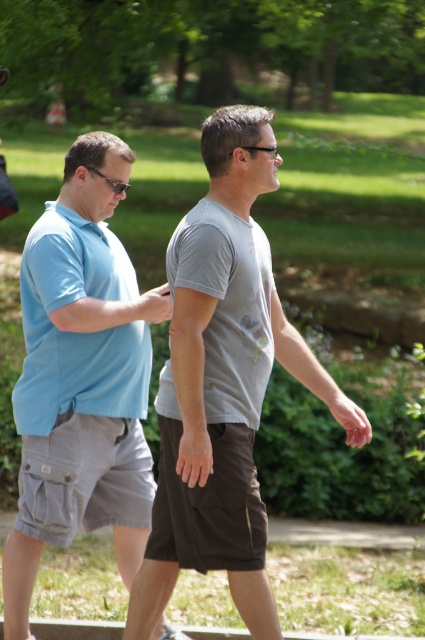
You are a photographer trying to capture a candid shot of the two people in the park. You want to ensure that both the matte blue polo shirt at left and the black plastic glasses at center are visible in the frame. Based on their positions, which object should you focus on first to include both in the shot?

Since the matte blue polo shirt at left is to the left of the black plastic glasses at center, you should focus on the matte blue polo shirt at left first to ensure both are in the frame.

You are a fashion designer observing two people in a park. You need to determine which item is taller between the matte blue polo shirt at left and the black plastic glasses at center. Which one is taller?

The matte blue polo shirt at left is taller than the black plastic glasses at center.